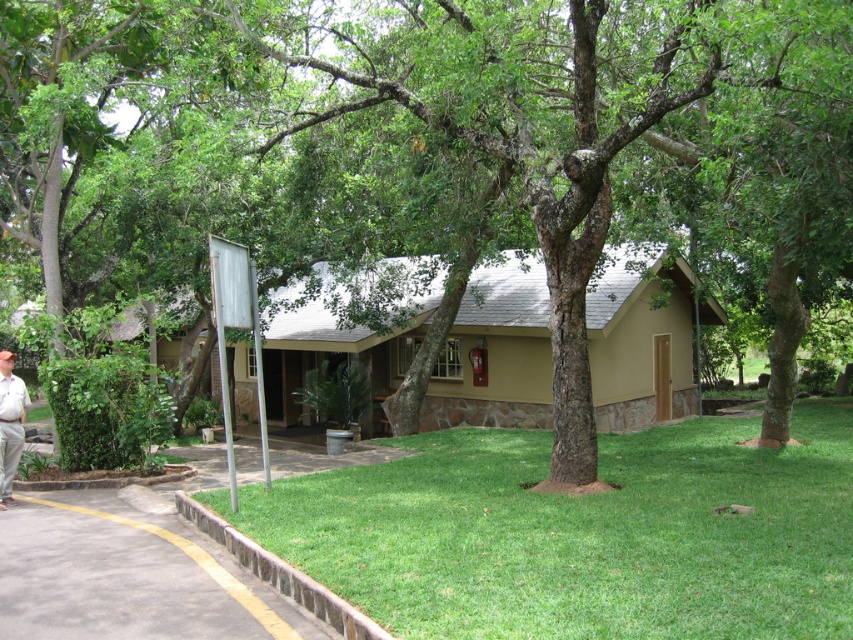
Is gray asphalt pavement at lower left wider than light beige pants at lower left?

Correct, the width of gray asphalt pavement at lower left exceeds that of light beige pants at lower left.

Does gray asphalt pavement at lower left appear on the left side of light beige pants at lower left?

No, gray asphalt pavement at lower left is not to the left of light beige pants at lower left.

Which is in front, point (119, 557) or point (1, 381)?

Point (119, 557) is in front.

I want to click on gray asphalt pavement at lower left, so click(128, 577).

Based on the photo, which is below, green grass at lower center or gray asphalt pavement at lower left?

gray asphalt pavement at lower left is lower down.

Does green grass at lower center have a smaller size compared to gray asphalt pavement at lower left?

Incorrect, green grass at lower center is not smaller in size than gray asphalt pavement at lower left.

Where is `green grass at lower center`? The image size is (853, 640). green grass at lower center is located at coordinates (581, 532).

Does green grass at lower center have a lesser height compared to light beige pants at lower left?

No.

Which is more to the right, green grass at lower center or light beige pants at lower left?

From the viewer's perspective, green grass at lower center appears more on the right side.

Identify the location of green grass at lower center. click(581, 532).